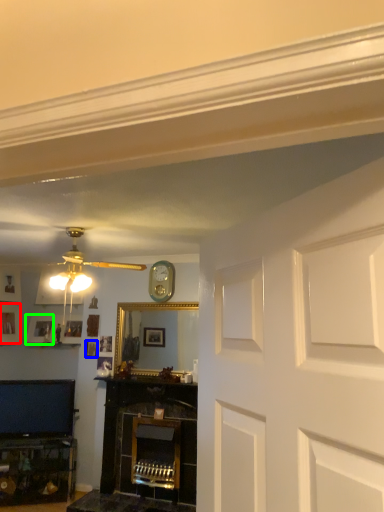
Question: Considering the real-world distances, which object is farthest from picture frame (highlighted by a red box)? picture frame (highlighted by a blue box) or picture frame (highlighted by a green box)?

Choices:
 (A) picture frame
 (B) picture frame

Answer: (A)